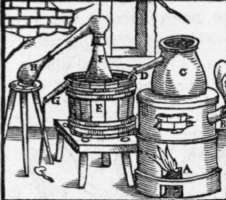
Where is `floor`? The width and height of the screenshot is (226, 200). floor is located at coordinates (13, 157).